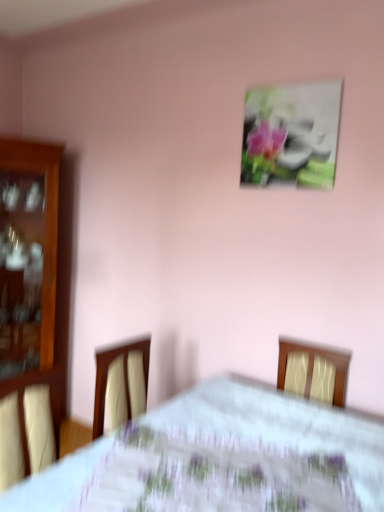
What is the approximate width of metallic silver frame at upper center?

1.97 inches.

In order to click on white floral tablecloth at center in this screenshot , I will do `click(221, 458)`.

Locate an element on the screen. wooden cabinet at left is located at coordinates click(x=28, y=307).

Is white floral tablecloth at center outside of metallic silver frame at upper center?

Indeed, white floral tablecloth at center is completely outside metallic silver frame at upper center.

Does point (127, 483) come closer to viewer compared to point (327, 173)?

Yes, it is.

Does white floral tablecloth at center have a greater width compared to metallic silver frame at upper center?

Yes, white floral tablecloth at center is wider than metallic silver frame at upper center.

Considering the relative positions of wooden cabinet at left and metallic silver frame at upper center in the image provided, is wooden cabinet at left to the left or to the right of metallic silver frame at upper center?

Clearly, wooden cabinet at left is on the left of metallic silver frame at upper center in the image.

In order to click on furniture below the metallic silver frame at upper center (from a real-world perspective) in this screenshot , I will do `click(28, 307)`.

Considering their positions, is wooden cabinet at left located in front of or behind metallic silver frame at upper center?

Visually, wooden cabinet at left is located behind metallic silver frame at upper center.

Can you confirm if wooden cabinet at left is shorter than metallic silver frame at upper center?

Incorrect, the height of wooden cabinet at left does not fall short of that of metallic silver frame at upper center.

Which is more to the right, metallic silver frame at upper center or wooden cabinet at left?

From the viewer's perspective, metallic silver frame at upper center appears more on the right side.

Is point (245, 142) positioned before point (33, 154)?

Yes, it is.

Can you confirm if metallic silver frame at upper center is wider than wooden cabinet at left?

No.

Which is behind, point (52, 166) or point (191, 507)?

The point (52, 166) is farther from the camera.

Is wooden cabinet at left facing away from white floral tablecloth at center?

wooden cabinet at left is not turned away from white floral tablecloth at center.

Measure the distance from wooden cabinet at left to white floral tablecloth at center.

A: 5.69 feet.

From the image's perspective, relative to white floral tablecloth at center, is wooden cabinet at left above or below?

wooden cabinet at left is situated higher than white floral tablecloth at center in the image.

From a real-world perspective, is metallic silver frame at upper center positioned over white floral tablecloth at center based on gravity?

Correct, in the physical world, metallic silver frame at upper center is higher than white floral tablecloth at center.

Based on the photo, can you confirm if metallic silver frame at upper center is positioned to the left of white floral tablecloth at center?

No, metallic silver frame at upper center is not to the left of white floral tablecloth at center.

Which of these two, metallic silver frame at upper center or white floral tablecloth at center, stands taller?

With more height is white floral tablecloth at center.

Is the surface of metallic silver frame at upper center in direct contact with white floral tablecloth at center?

No, metallic silver frame at upper center is not beside white floral tablecloth at center.

From a real-world perspective, is white floral tablecloth at center positioned above or below wooden cabinet at left?

white floral tablecloth at center is situated lower than wooden cabinet at left in the real world.

Is white floral tablecloth at center beside wooden cabinet at left?

No, white floral tablecloth at center is not next to wooden cabinet at left.

Which of these two, white floral tablecloth at center or wooden cabinet at left, is bigger?

white floral tablecloth at center.

Is white floral tablecloth at center aimed at wooden cabinet at left?

No.

This screenshot has width=384, height=512. What are the coordinates of `picture frame above the white floral tablecloth at center (from the image's perspective)` in the screenshot? It's located at (291, 135).

Locate an element on the screen. The height and width of the screenshot is (512, 384). furniture located underneath the metallic silver frame at upper center (from a real-world perspective) is located at coordinates (28, 307).

Based on their spatial positions, is white floral tablecloth at center or wooden cabinet at left further from metallic silver frame at upper center?

wooden cabinet at left is positioned further to the anchor metallic silver frame at upper center.

From the image, which object appears to be farther from white floral tablecloth at center, metallic silver frame at upper center or wooden cabinet at left?

Among the two, wooden cabinet at left is located further to white floral tablecloth at center.

When comparing their distances from white floral tablecloth at center, does wooden cabinet at left or metallic silver frame at upper center seem further?

wooden cabinet at left is positioned further to the anchor white floral tablecloth at center.

Considering their positions, is metallic silver frame at upper center positioned further to wooden cabinet at left than white floral tablecloth at center?

white floral tablecloth at center is positioned further to the anchor wooden cabinet at left.

When comparing their distances from wooden cabinet at left, does white floral tablecloth at center or metallic silver frame at upper center seem closer?

Among the two, metallic silver frame at upper center is located nearer to wooden cabinet at left.

Based on their spatial positions, is wooden cabinet at left or white floral tablecloth at center further from metallic silver frame at upper center?

wooden cabinet at left is further to metallic silver frame at upper center.

You are a GUI agent. You are given a task and a screenshot of the screen. Output one action in this format:
    pyautogui.click(x=<x>, y=<y>)
    Task: Click on the picture frame between white floral tablecloth at center and wooden cabinet at left in the front-back direction
    Image resolution: width=384 pixels, height=512 pixels.
    Given the screenshot: What is the action you would take?
    pyautogui.click(x=291, y=135)